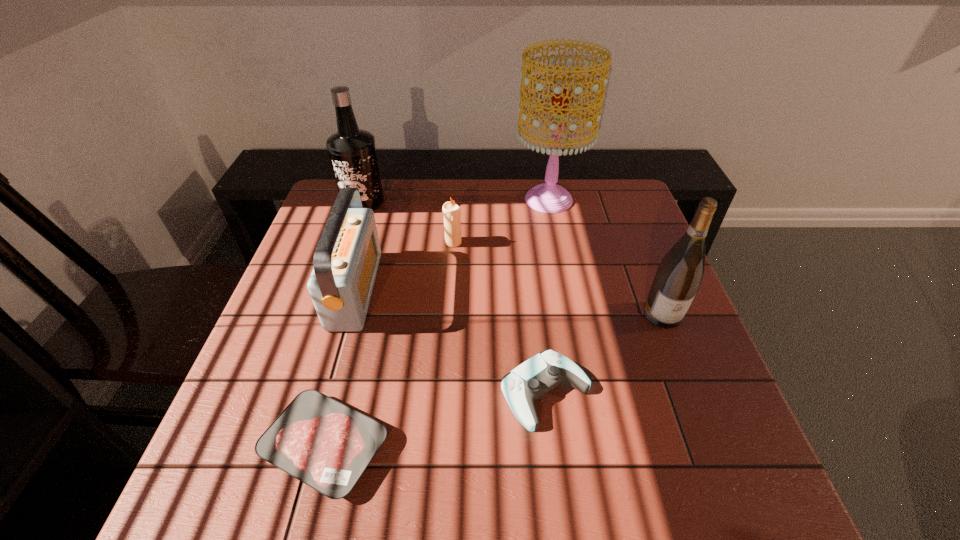
The image size is (960, 540). In order to click on the tallest object in this screenshot , I will do 549,197.

Find the location of a particular element. The height and width of the screenshot is (540, 960). liquor is located at coordinates (x=352, y=151).

Find the location of a particular element. Image resolution: width=960 pixels, height=540 pixels. wine bottle is located at coordinates [679, 275].

Where is `radio receiver`? The width and height of the screenshot is (960, 540). radio receiver is located at coordinates (346, 259).

Find the location of a particular element. the third farthest object is located at coordinates (452, 213).

This screenshot has width=960, height=540. I want to click on candle, so click(x=452, y=213).

At what (x,y) coordinates should I click in order to perform the action: click on the second shortest object. Please return your answer as a coordinate pair (x, y). This screenshot has width=960, height=540. Looking at the image, I should click on (531, 380).

Where is `steak`? The height and width of the screenshot is (540, 960). steak is located at coordinates (327, 445).

Where is `vacant space located 0.390m on the left of the tallest object`? This screenshot has width=960, height=540. vacant space located 0.390m on the left of the tallest object is located at coordinates (390, 199).

At what (x,y) coordinates should I click in order to perform the action: click on free space located on the front label of the liquor. Please return your answer as a coordinate pair (x, y). This screenshot has width=960, height=540. Looking at the image, I should click on (336, 283).